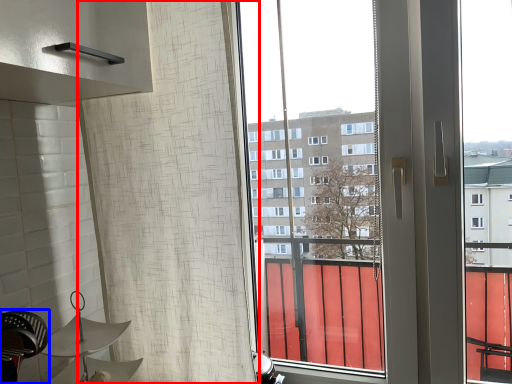
Question: Among these objects, which one is farthest to the camera, shower curtain (highlighted by a red box) or swivel chair (highlighted by a blue box)?

Choices:
 (A) shower curtain
 (B) swivel chair

Answer: (A)